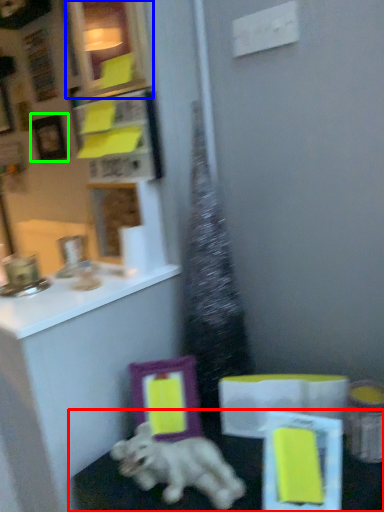
Question: Which object is the closest to the table (highlighted by a red box)? Choose among these: picture frame (highlighted by a blue box) or picture frame (highlighted by a green box).

Choices:
 (A) picture frame
 (B) picture frame

Answer: (A)